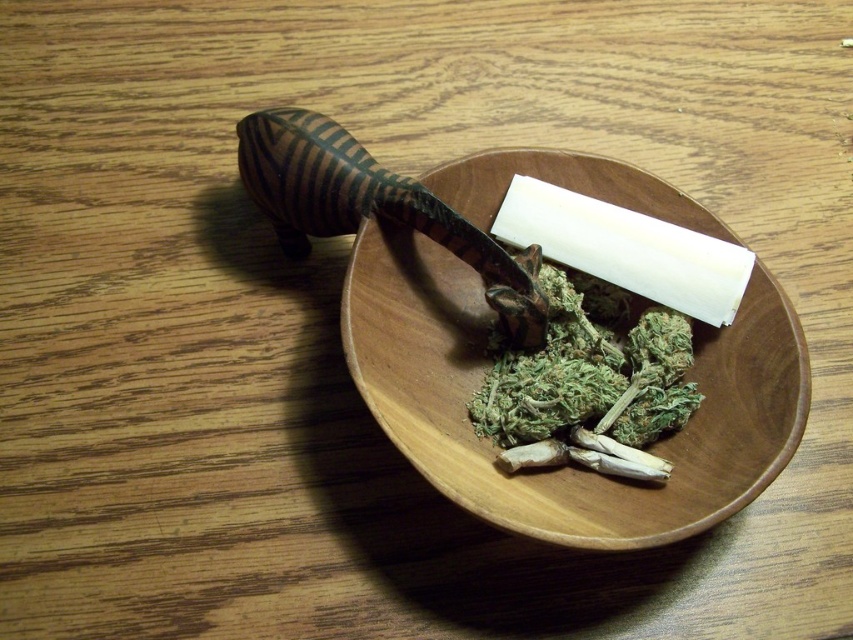
You are a person who wants to place a small ornament on the table. You have a wooden bowl at center and a green leafy material at center. Which object should you move to make space?

The wooden bowl at center is above the green leafy material at center, so you should move the wooden bowl at center to make space.